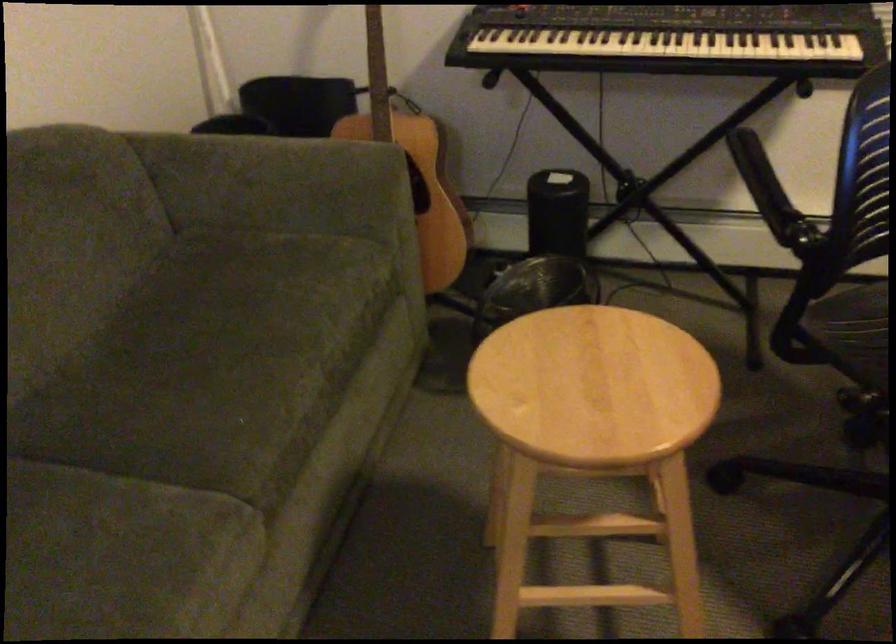
Identify the location of chair sitting surface. This screenshot has height=644, width=896. (855, 330).